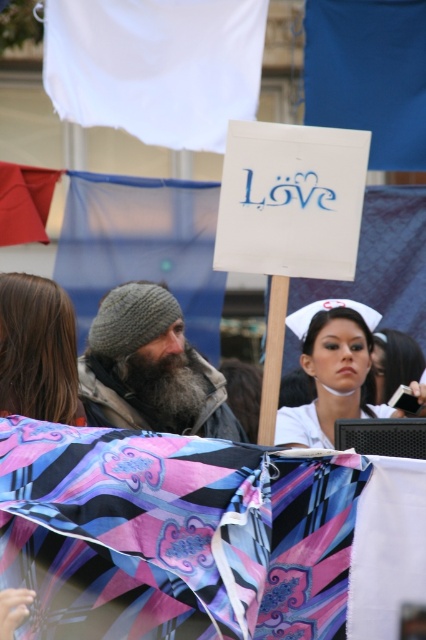
Between gray knitted beanie at center and white matte nurse cap at center, which one appears on the left side from the viewer's perspective?

Positioned to the left is gray knitted beanie at center.

Which is behind, point (161, 360) or point (363, 410)?

Point (363, 410)

The image size is (426, 640). I want to click on gray knitted beanie at center, so click(x=152, y=368).

Which of these two, brown hair at left or white matte nurse cap at center, stands shorter?

Standing shorter between the two is brown hair at left.

Between point (14, 300) and point (354, 412), which one is positioned behind?

Positioned behind is point (354, 412).

Who is more forward, (40, 419) or (354, 417)?

Point (40, 419)

Find the location of `brown hair at left`. brown hair at left is located at coordinates (37, 349).

Which is more to the left, gray knitted beanie at center or brown hair at left?

From the viewer's perspective, brown hair at left appears more on the left side.

Does gray knitted beanie at center appear on the left side of brown hair at left?

In fact, gray knitted beanie at center is to the right of brown hair at left.

Who is more forward, (124, 321) or (45, 412)?

Point (45, 412)

Where is `gray knitted beanie at center`? gray knitted beanie at center is located at coordinates (152, 368).